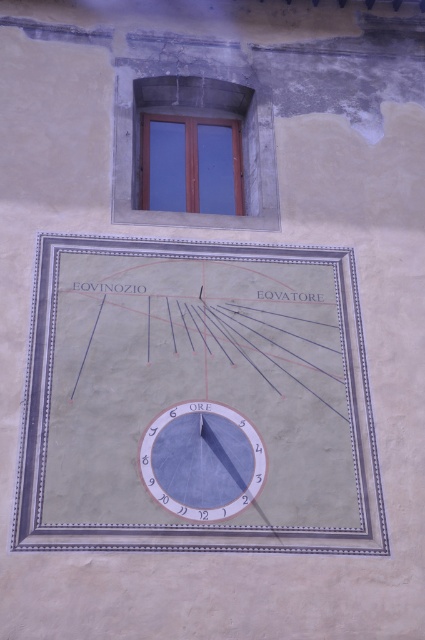
You are standing outside the building and looking at the wall with the decorative elements. There is a matte gray clock at center and a wooden window at upper center. Which object is positioned higher on the wall?

The wooden window at upper center is positioned higher on the wall since the matte gray clock at center is located below it.

You are standing in front of the building and notice the matte gray clock at center and the wooden window at upper center. Which object is closer to you?

The matte gray clock at center is closer to you since it is in front of the wooden window at upper center.

You are standing in front of a building and see the matte gray clock at center. If you want to take a photo of the clock with your smartphone, which has a minimum focus distance of 0.5 meters, will you be able to focus on the clock from where you are?

The matte gray clock at center is 9.68 meters away from you. Since your smartphone has a minimum focus distance of 0.5 meters, it can focus on objects beyond that distance. Therefore, you can focus on the matte gray clock at center from your current position.